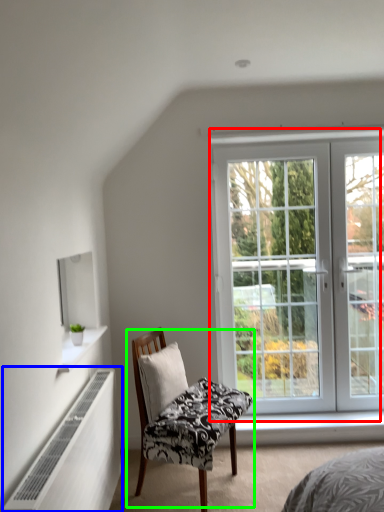
Question: Based on their relative distances, which object is farther from window (highlighted by a red box)? Choose from radiator (highlighted by a blue box) and chair (highlighted by a green box).

Choices:
 (A) radiator
 (B) chair

Answer: (A)